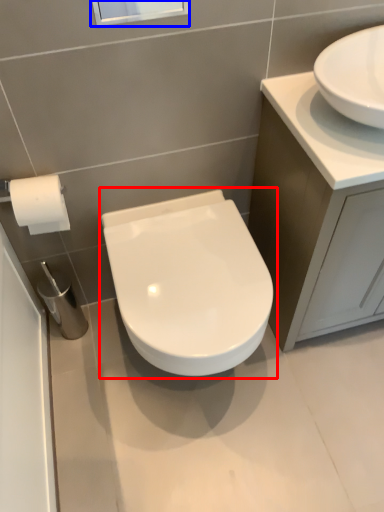
Question: Which point is closer to the camera, toilet (highlighted by a red box) or window screen (highlighted by a blue box)?

Choices:
 (A) toilet
 (B) window screen

Answer: (B)